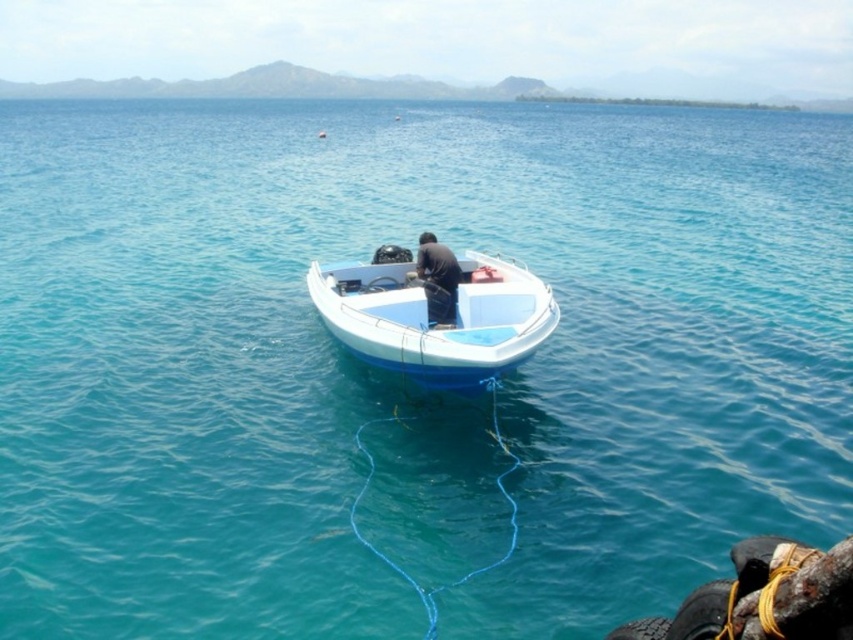
Based on the coordinates provided, where is the white plastic boat at center located in the image?

The white plastic boat at center is located at the coordinates point (434, 317) in the image.